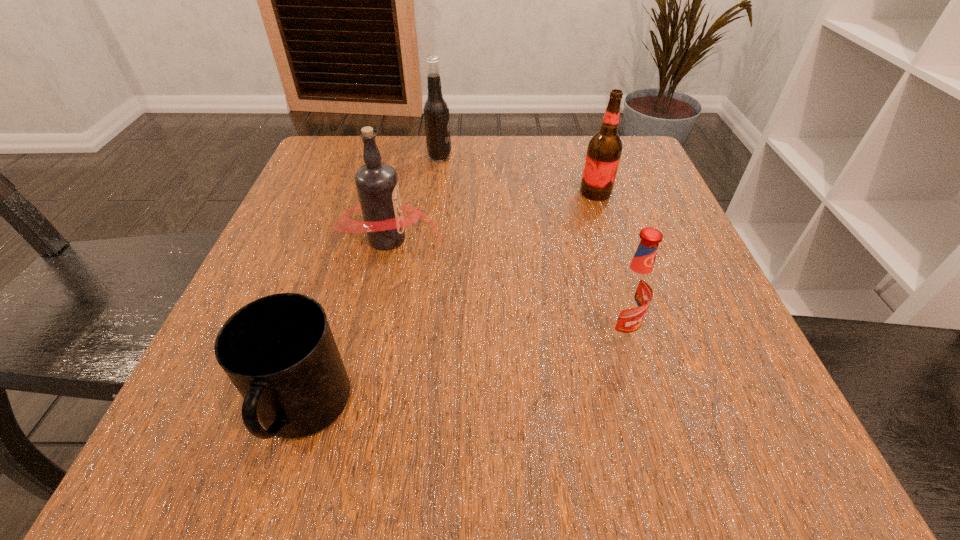
Where is `vacant region at the near left corner of the desktop`? The width and height of the screenshot is (960, 540). vacant region at the near left corner of the desktop is located at coordinates (166, 460).

The image size is (960, 540). I want to click on vacant point at the far right corner, so click(x=636, y=147).

In order to click on free space at the near right corner of the desktop in this screenshot , I will do `click(776, 436)`.

Where is `vacant area between the mug and the second nearest object`? The height and width of the screenshot is (540, 960). vacant area between the mug and the second nearest object is located at coordinates (460, 373).

Identify the location of unoccupied position between the second nearest object and the third nearest root beer. (607, 264).

In order to click on vacant point located between the second nearest root beer and the farthest root beer in this screenshot , I will do `click(414, 198)`.

Locate an element on the screen. vacant area between the second nearest root beer and the farthest root beer is located at coordinates (414, 198).

The image size is (960, 540). I want to click on blank region between the shortest object and the third nearest object, so click(346, 325).

At what (x,y) coordinates should I click in order to perform the action: click on free space between the third nearest root beer and the farthest root beer. Please return your answer as a coordinate pair (x, y). Looking at the image, I should click on (517, 175).

I want to click on free space between the second farthest object and the third nearest object, so click(x=492, y=215).